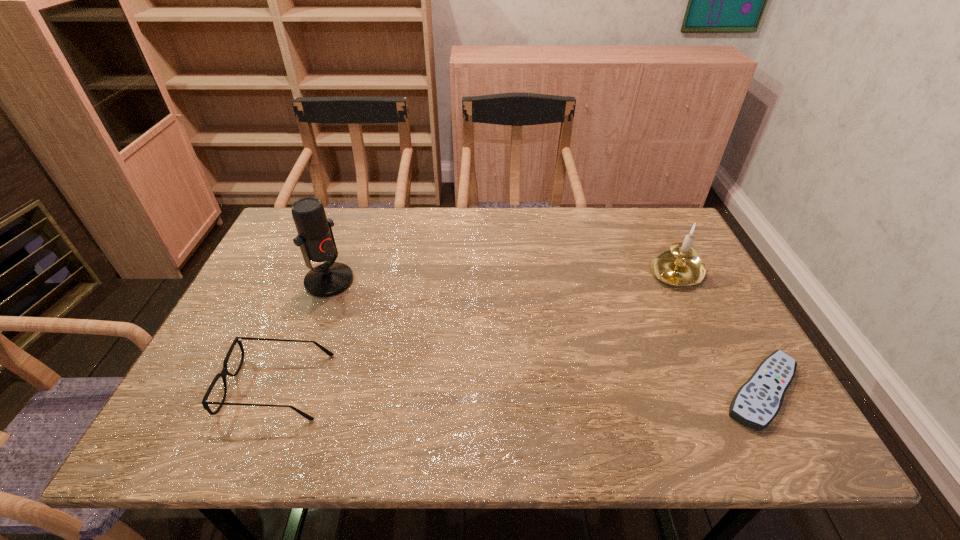
Locate an element on the screen. The width and height of the screenshot is (960, 540). blank space located on the side of the microphone with the red ring is located at coordinates (452, 356).

The height and width of the screenshot is (540, 960). I want to click on free space located 0.180m on the side of the microphone with the red ring, so click(394, 320).

Locate an element on the screen. spectacles at the near edge is located at coordinates (224, 372).

This screenshot has height=540, width=960. Identify the location of remote control located at the near edge. (757, 402).

Where is `spectacles present at the left edge`? The height and width of the screenshot is (540, 960). spectacles present at the left edge is located at coordinates (224, 372).

Where is `microphone that is at the left edge`? The image size is (960, 540). microphone that is at the left edge is located at coordinates (315, 237).

The image size is (960, 540). In order to click on remote control located at the right edge in this screenshot , I will do (x=757, y=402).

Identify the location of candle holder that is at the right edge. The height and width of the screenshot is (540, 960). (680, 266).

At what (x,y) coordinates should I click in order to perform the action: click on object positioned at the near left corner. Please return your answer as a coordinate pair (x, y). This screenshot has width=960, height=540. Looking at the image, I should click on (224, 372).

Identify the location of object at the near right corner. (757, 402).